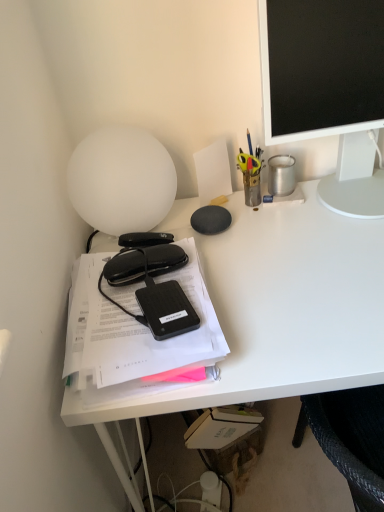
Locate an element on the screen. This screenshot has height=512, width=384. space that is in front of black plastic external hard drive at center is located at coordinates (162, 368).